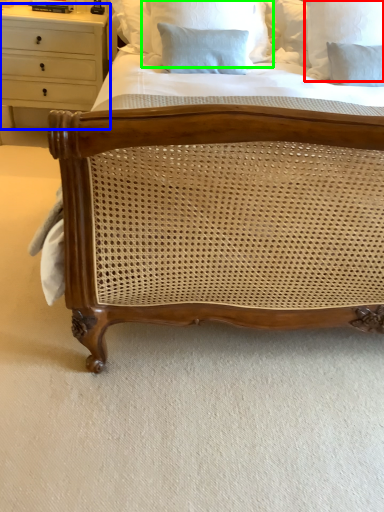
Question: Which object is positioned closest to pillow (highlighted by a red box)? Select from chest of drawers (highlighted by a blue box) and pillow (highlighted by a green box).

Choices:
 (A) chest of drawers
 (B) pillow

Answer: (B)